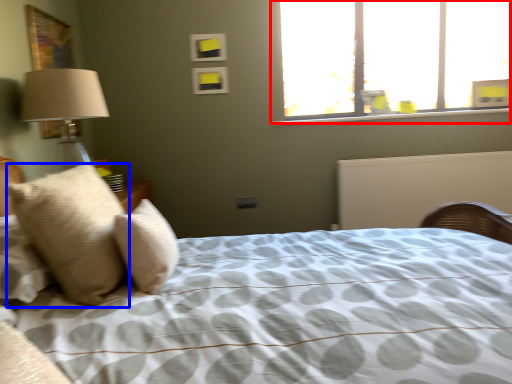
Question: Which object is closer to the camera taking this photo, window (highlighted by a red box) or pillow (highlighted by a blue box)?

Choices:
 (A) window
 (B) pillow

Answer: (B)